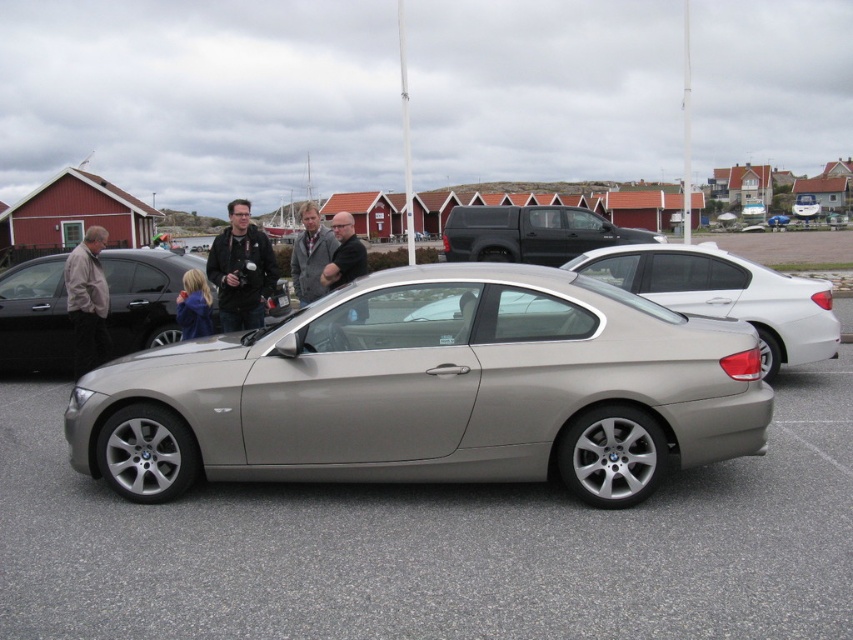
You are a photographer trying to capture a wide shot of the scene. You need to ensure both the satin metallic car at center and the matte black car at left are fully visible in the frame. Based on their widths, which car might require you to adjust your camera angle to avoid cropping?

The satin metallic car at center might be wider than the matte black car at left, so it might require adjusting the camera angle to ensure it fits entirely in the frame without cropping.

You are a photographer standing at the edge of the scene. You need to capture a photo that includes both the satin metallic car at center and the gray wool coat at center. Given that your camera has a maximum focus range of 12 feet, will you be able to include both objects in the same frame without moving closer?

The satin metallic car at center and gray wool coat at center are 12.14 feet apart from each other. Since the distance between them exceeds the camera maximum focus range of 12 feet, you cannot include both objects in the same frame without moving closer.